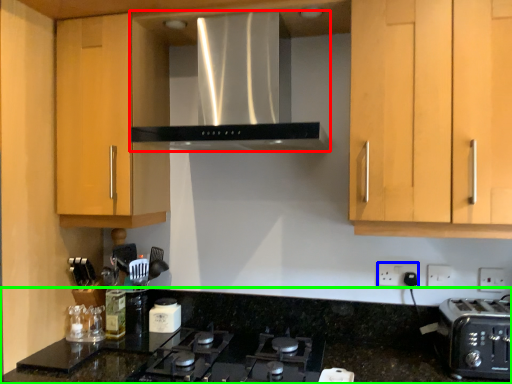
Question: Considering the real-world distances, which object is farthest from home appliance (highlighted by a red box)? electric outlet (highlighted by a blue box) or countertop (highlighted by a green box)?

Choices:
 (A) electric outlet
 (B) countertop

Answer: (A)